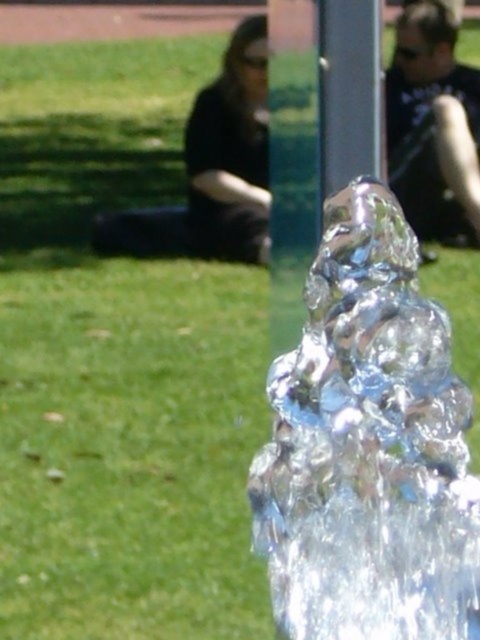
You are standing in front of the fountain and notice the clear glass water at center and the matte black shirt at upper right. Which object is positioned higher up in the image?

The matte black shirt at upper right is positioned higher up in the image than the clear glass water at center.

You are standing in the park and see the clear glass water at center and the matte black shirt at upper right. Which object takes up more space in the image?

The clear glass water at center takes up more space in the image because it is bigger than the matte black shirt at upper right.

You are standing at the center of the fountain and want to pour some clear glass water at center into a container. Which direction should you move to reach the water?

The clear glass water at center is located at point [369,448], so you should move towards the coordinates [369,448] to reach the water.